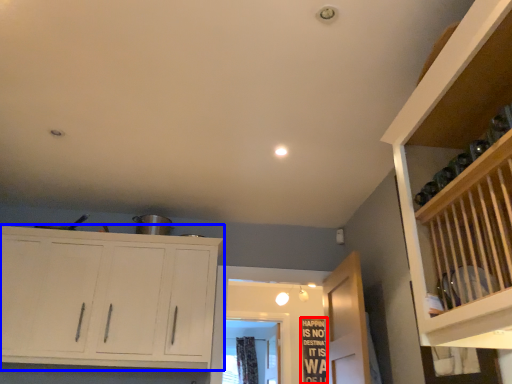
Question: Which object is further to the camera taking this photo, bulletin board (highlighted by a red box) or cupboard (highlighted by a blue box)?

Choices:
 (A) bulletin board
 (B) cupboard

Answer: (A)